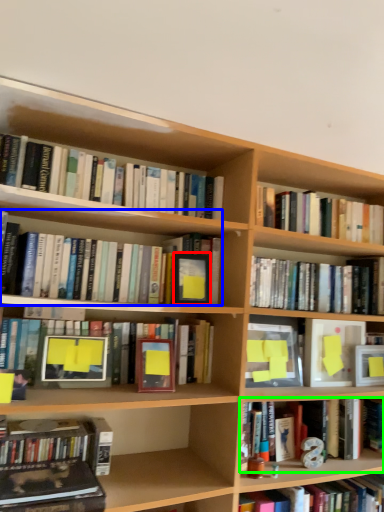
Question: Considering the real-world distances, which object is closest to paperback book (highlighted by a red box)? book (highlighted by a blue box) or book (highlighted by a green box).

Choices:
 (A) book
 (B) book

Answer: (A)